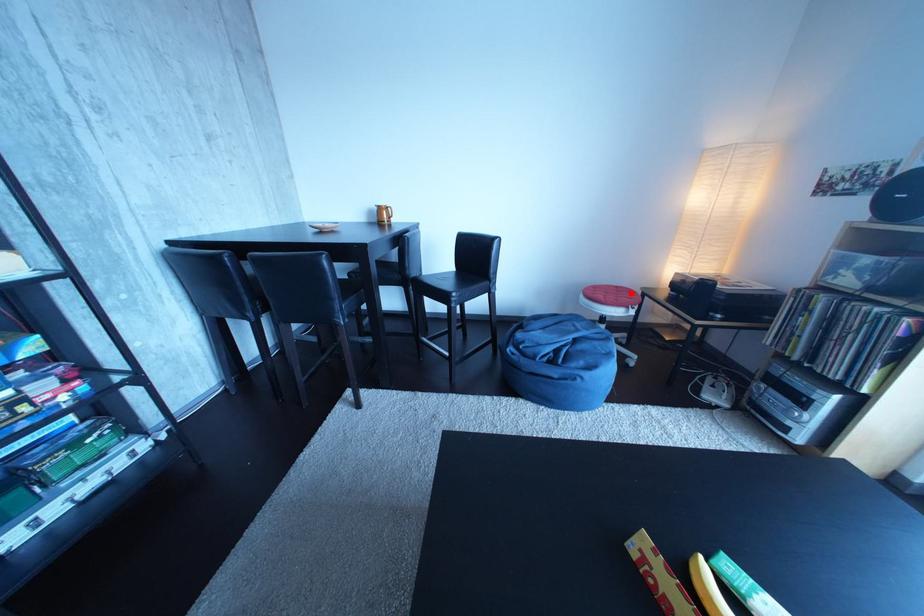
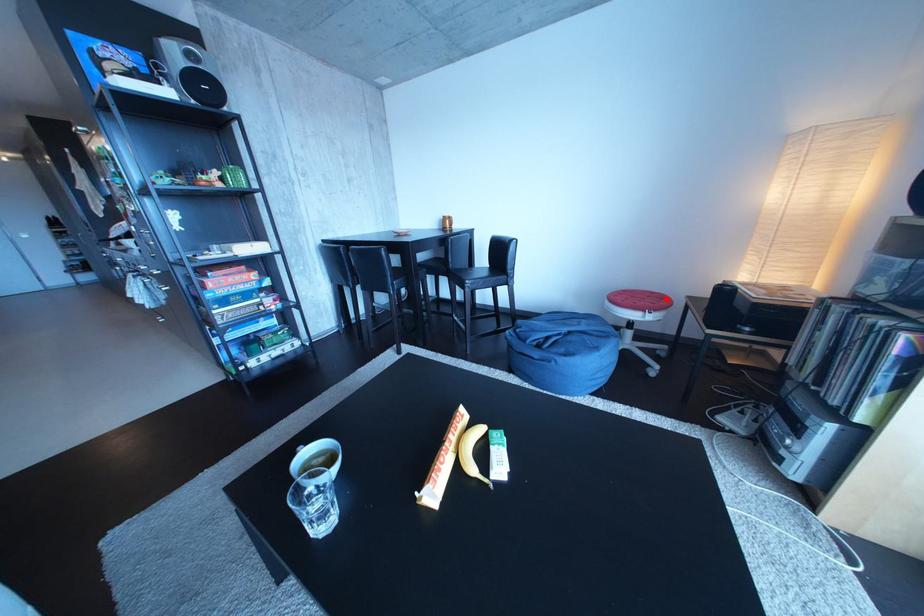
I am providing you with two images of the same scene from different viewpoints. A red point is marked on the first image and another point is marked on the second image. Does the point marked in image1 correspond to the same location as the one in image2?

Yes